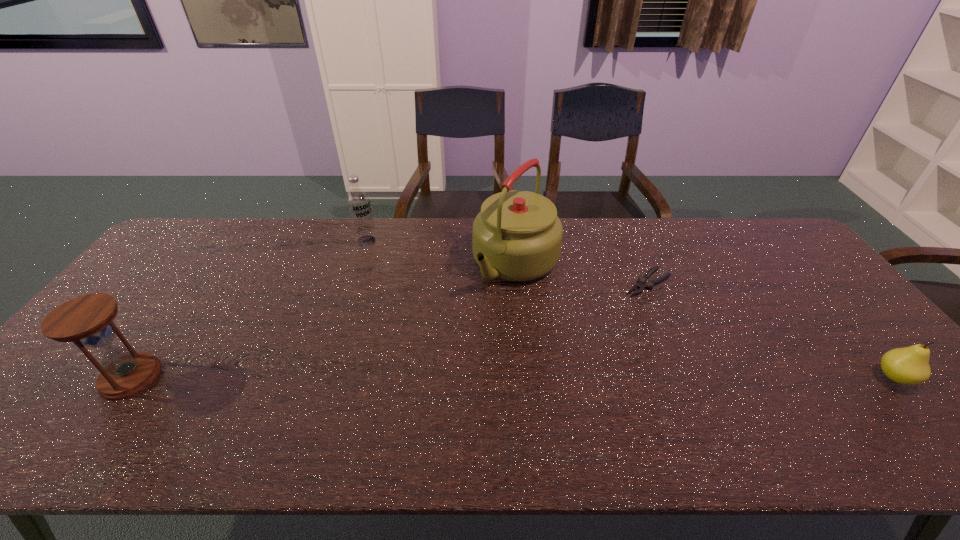
Locate an element on the screen. blank space located at the spout of the kettle is located at coordinates (427, 368).

Where is `free location located at the spout of the kettle`? free location located at the spout of the kettle is located at coordinates (432, 362).

Locate an element on the screen. This screenshot has width=960, height=540. free space located 0.130m at the spout of the kettle is located at coordinates [x=469, y=321].

Where is `free region located 0.380m on the front label of the vodka`? Image resolution: width=960 pixels, height=540 pixels. free region located 0.380m on the front label of the vodka is located at coordinates (398, 326).

I want to click on vacant space located 0.390m on the front label of the vodka, so click(399, 328).

Find the location of a particular element. The height and width of the screenshot is (540, 960). vacant area situated 0.200m on the front label of the vodka is located at coordinates (382, 285).

I want to click on blank area located 0.060m at the gripping part of the pliers, so click(x=619, y=301).

Identify the location of vacant space positioned 0.370m at the gripping part of the pliers. (542, 355).

Find the location of a particular element. vacant space situated at the gripping part of the pliers is located at coordinates (548, 350).

The image size is (960, 540). I want to click on kettle that is positioned at the far edge, so click(x=517, y=236).